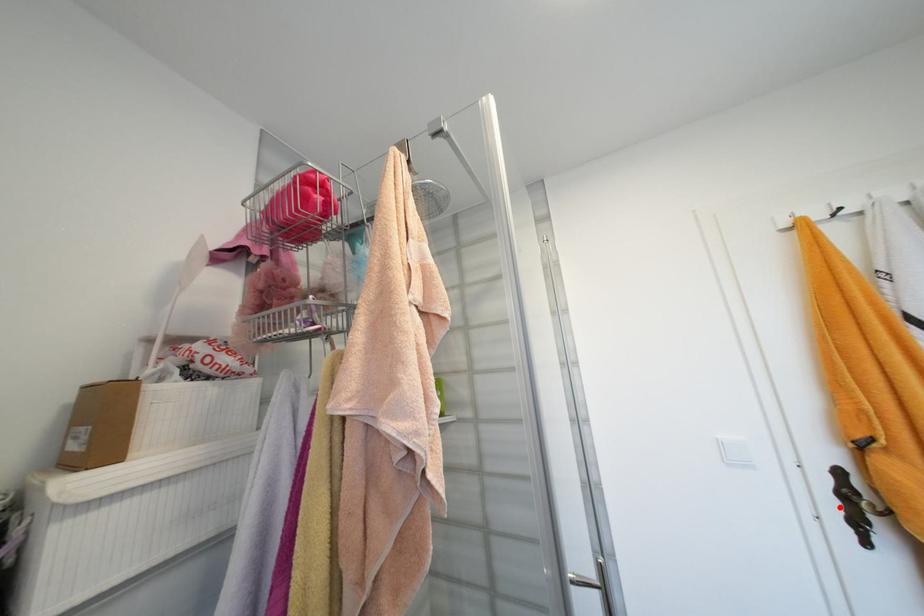
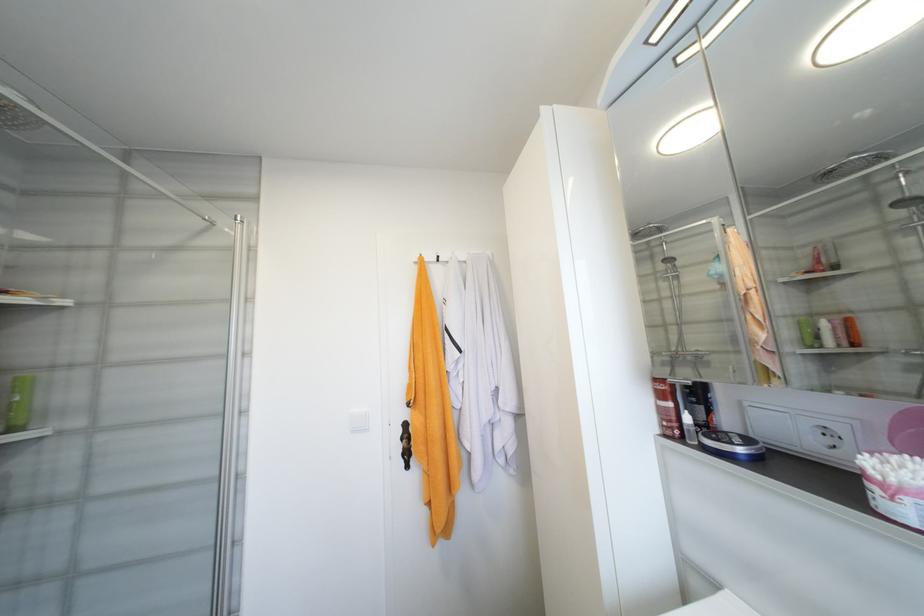
Question: A red point is marked in image1. In image2, is the corresponding 3D point closer to the camera or farther? Reply with the corresponding letter.

Choices:
 (A) The corresponding 3D point is closer.
 (B) The corresponding 3D point is farther.

Answer: (B)